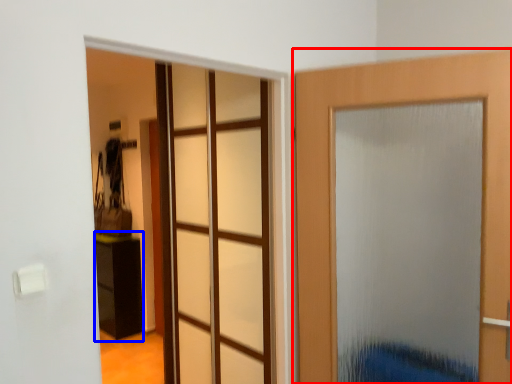
Question: Which object is closer to the camera taking this photo, door (highlighted by a red box) or furniture (highlighted by a blue box)?

Choices:
 (A) door
 (B) furniture

Answer: (A)